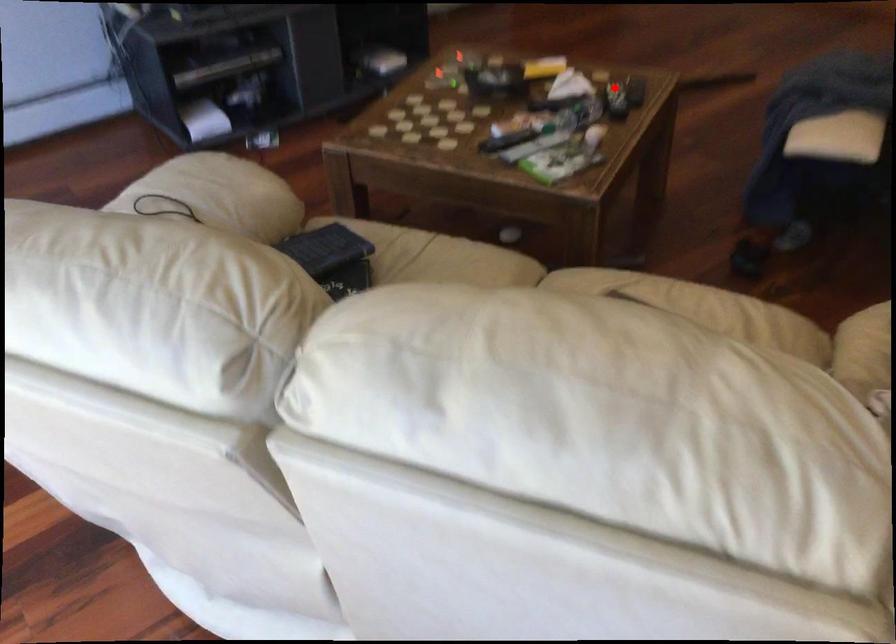
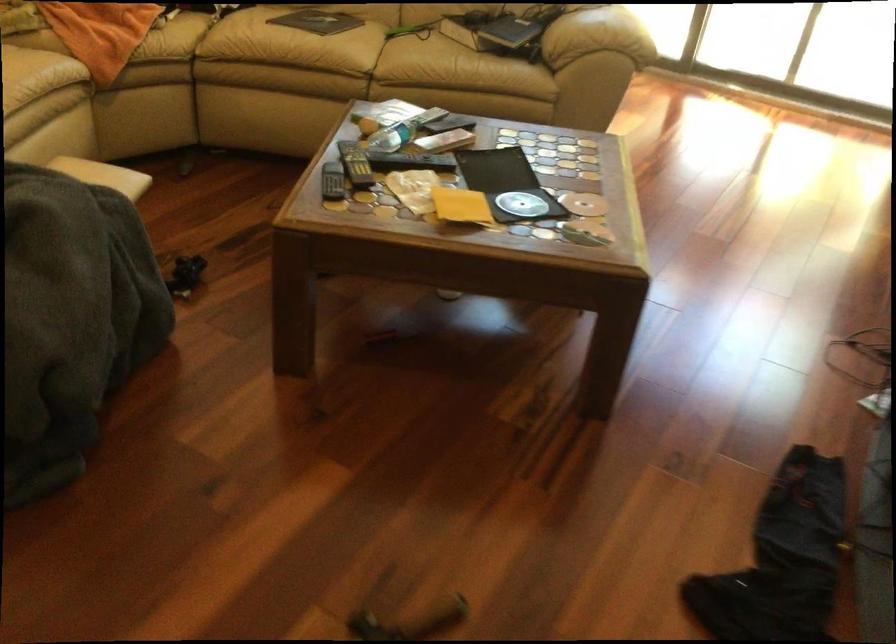
Where in the second image is the point corresponding to the highlighted location from the first image?

(355, 164)